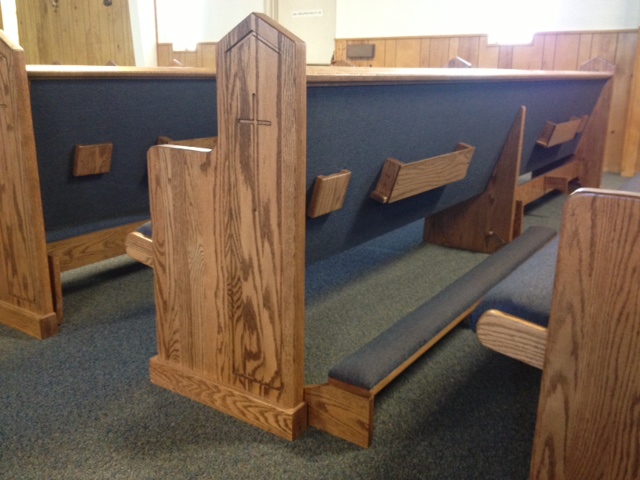
Find the location of `white wall`. white wall is located at coordinates (406, 12), (588, 11).